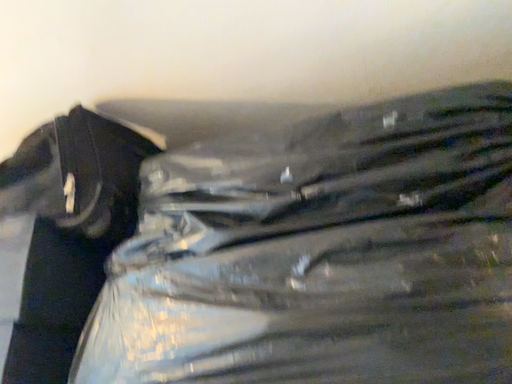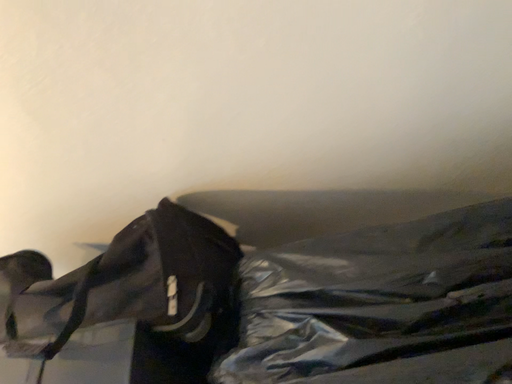
Question: How did the camera likely rotate when shooting the video?

Choices:
 (A) rotated downward
 (B) rotated upward

Answer: (B)